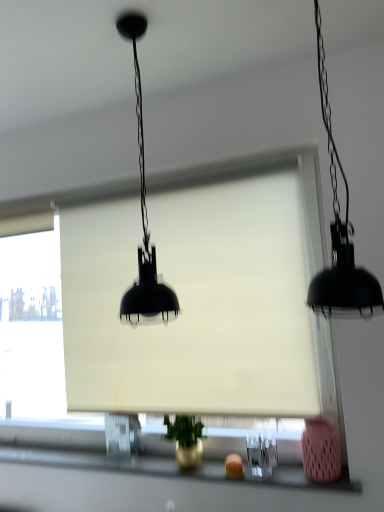
Question: Is white matte window screen at center facing away from metallic gold vase at lower center?

Choices:
 (A) no
 (B) yes

Answer: (A)

Question: From a real-world perspective, is white matte window screen at center physically below metallic gold vase at lower center?

Choices:
 (A) no
 (B) yes

Answer: (A)

Question: Is white matte window screen at center closer to camera compared to metallic gold vase at lower center?

Choices:
 (A) no
 (B) yes

Answer: (A)

Question: Could you tell me if white matte window screen at center is facing metallic gold vase at lower center?

Choices:
 (A) yes
 (B) no

Answer: (B)

Question: Can you confirm if white matte window screen at center is taller than metallic gold vase at lower center?

Choices:
 (A) no
 (B) yes

Answer: (B)

Question: From the image's perspective, relative to matte black lampshade at center, marked as the 2th lamp in a right-to-left arrangement, is black matte pendant light at right, which is the second lamp in left-to-right order, above or below?

Choices:
 (A) below
 (B) above

Answer: (B)

Question: From their relative heights in the image, would you say black matte pendant light at right, which is the second lamp in left-to-right order, is taller or shorter than matte black lampshade at center, the 1th lamp when ordered from left to right?

Choices:
 (A) short
 (B) tall

Answer: (B)

Question: Is point (352, 275) positioned closer to the camera than point (122, 26)?

Choices:
 (A) closer
 (B) farther

Answer: (A)

Question: In terms of width, does black matte pendant light at right, the 1th lamp viewed from the right, look wider or thinner when compared to matte black lampshade at center, marked as the 2th lamp in a right-to-left arrangement?

Choices:
 (A) wide
 (B) thin

Answer: (B)

Question: In terms of width, does white matte window screen at center look wider or thinner when compared to metallic gold vase at lower center?

Choices:
 (A) wide
 (B) thin

Answer: (B)

Question: In terms of height, does white matte window screen at center look taller or shorter compared to metallic gold vase at lower center?

Choices:
 (A) short
 (B) tall

Answer: (B)

Question: Which is correct: white matte window screen at center is inside metallic gold vase at lower center, or outside of it?

Choices:
 (A) inside
 (B) outside

Answer: (B)

Question: Considering their positions, is white matte window screen at center located in front of or behind metallic gold vase at lower center?

Choices:
 (A) behind
 (B) front

Answer: (A)

Question: Is black matte pendant light at right, the 1th lamp viewed from the right, bigger or smaller than metallic gold vase at lower center?

Choices:
 (A) small
 (B) big

Answer: (B)

Question: Choose the correct answer: Is black matte pendant light at right, the 1th lamp viewed from the right, inside metallic gold vase at lower center or outside it?

Choices:
 (A) outside
 (B) inside

Answer: (A)